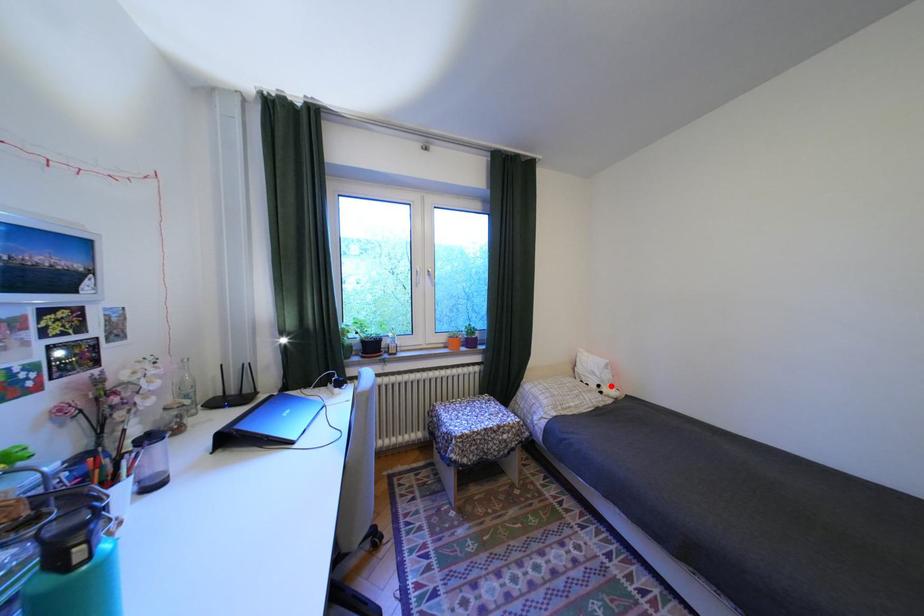
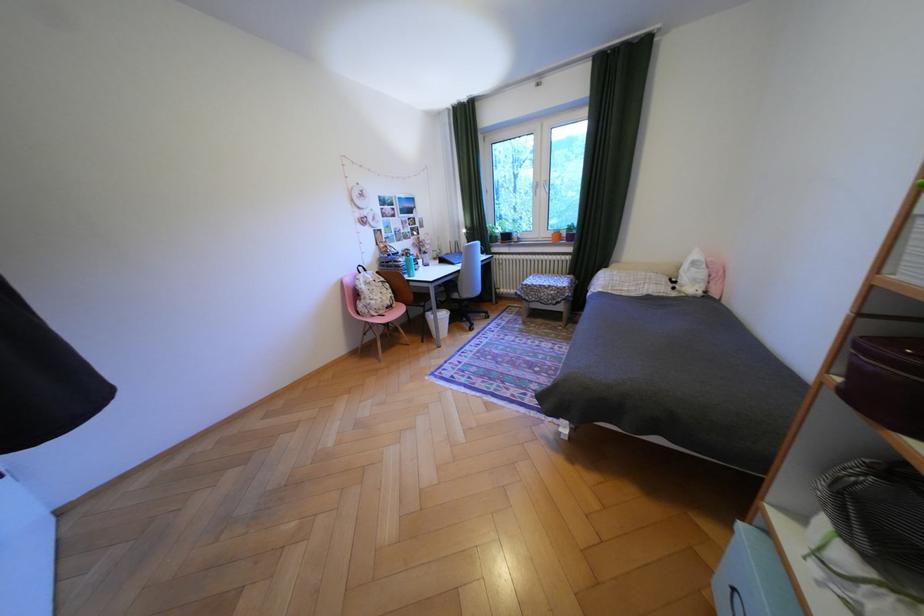
The point at the highlighted location is marked in the first image. Where is the corresponding point in the second image?

(687, 282)